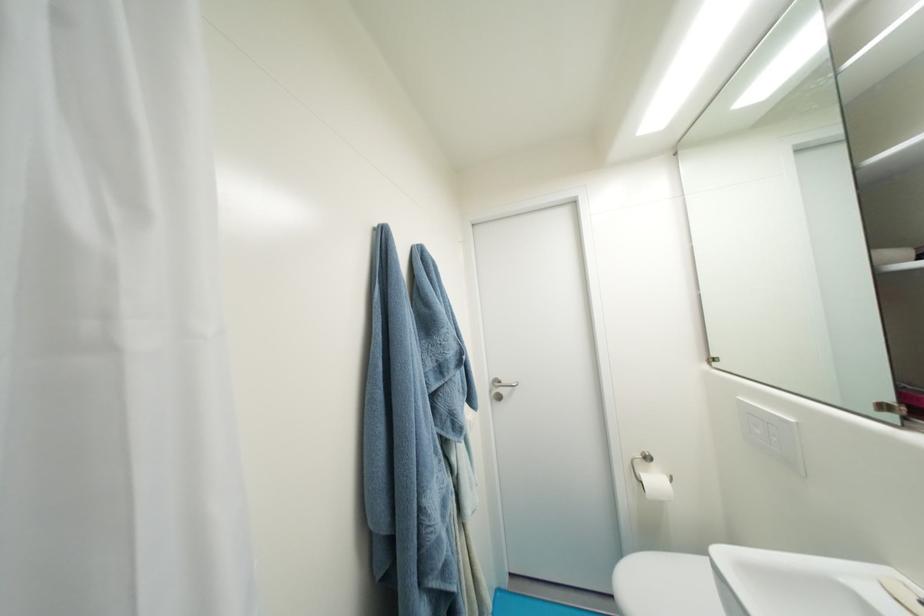
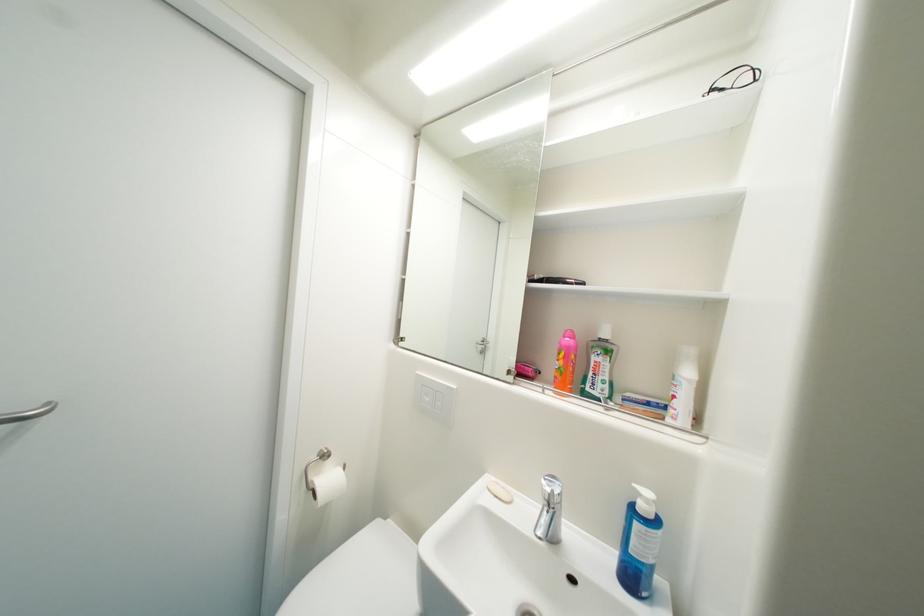
Where in the second image is the point corresponding to (x=721, y=367) from the first image?

(407, 345)